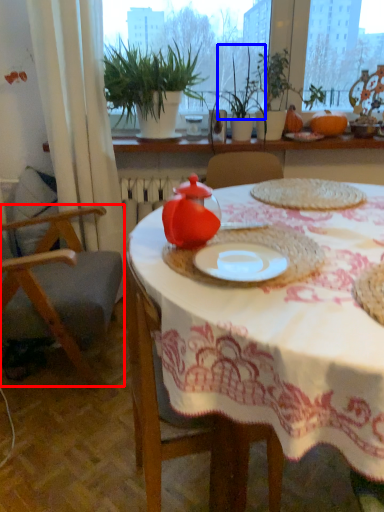
Question: Among these objects, which one is nearest to the camera, chair (highlighted by a red box) or plant (highlighted by a blue box)?

Choices:
 (A) chair
 (B) plant

Answer: (A)